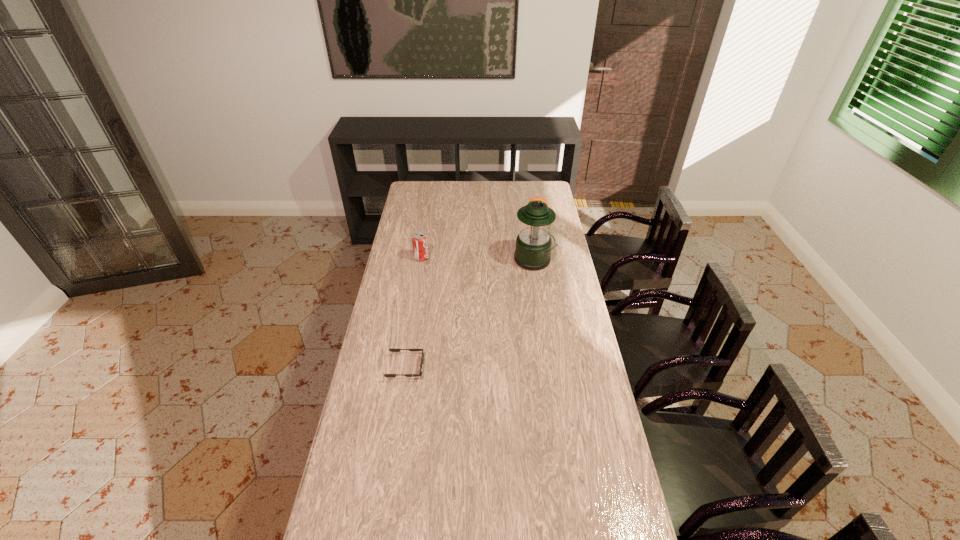
Where is `free space that is in between the shortest object and the farthest object`? Image resolution: width=960 pixels, height=540 pixels. free space that is in between the shortest object and the farthest object is located at coordinates (471, 292).

Find the location of a particular element. This screenshot has height=540, width=960. vacant space in between the soda can and the shortest object is located at coordinates (414, 313).

Where is `empty location between the third shortest object and the lantern`? empty location between the third shortest object and the lantern is located at coordinates (478, 259).

This screenshot has width=960, height=540. I want to click on empty space between the third shortest object and the shortest object, so click(414, 313).

Identify the location of free area in between the lantern and the third shortest object. The height and width of the screenshot is (540, 960). (478, 259).

Select which object appears as the third closest to the sunglasses. Please provide its 2D coordinates. Your answer should be formatted as a tuple, i.e. [(x, y)], where the tuple contains the x and y coordinates of a point satisfying the conditions above.

[(539, 198)]

Locate an element on the screen. The image size is (960, 540). the second closest object to the soda can is located at coordinates (391, 350).

Where is `vacant space that satisfies the following two spatial constraints: 1. on the back side of the tallest object; 2. on the right side of the farthest object`? The width and height of the screenshot is (960, 540). vacant space that satisfies the following two spatial constraints: 1. on the back side of the tallest object; 2. on the right side of the farthest object is located at coordinates (528, 215).

The width and height of the screenshot is (960, 540). I want to click on free space in the image that satisfies the following two spatial constraints: 1. on the front side of the tallest object; 2. on the right side of the second tallest object, so [x=421, y=260].